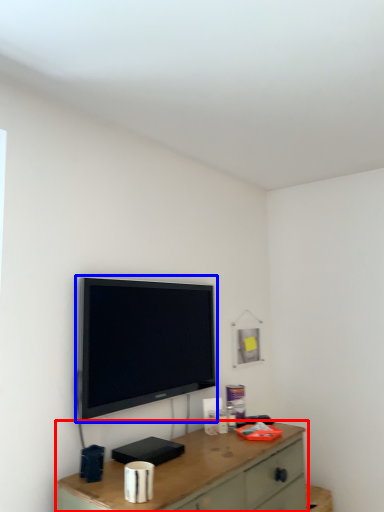
Question: Which object is closer to the camera taking this photo, desk (highlighted by a red box) or television (highlighted by a blue box)?

Choices:
 (A) desk
 (B) television

Answer: (A)